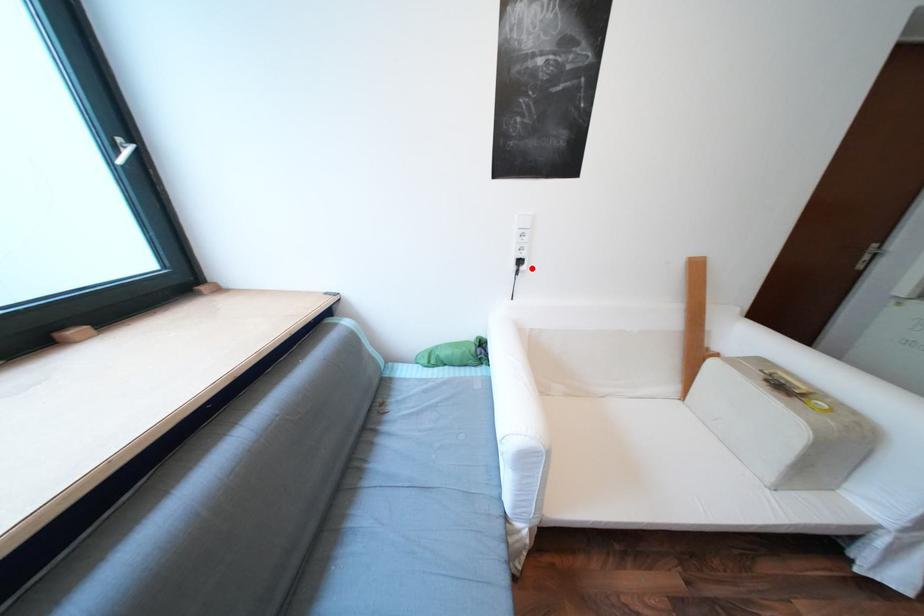
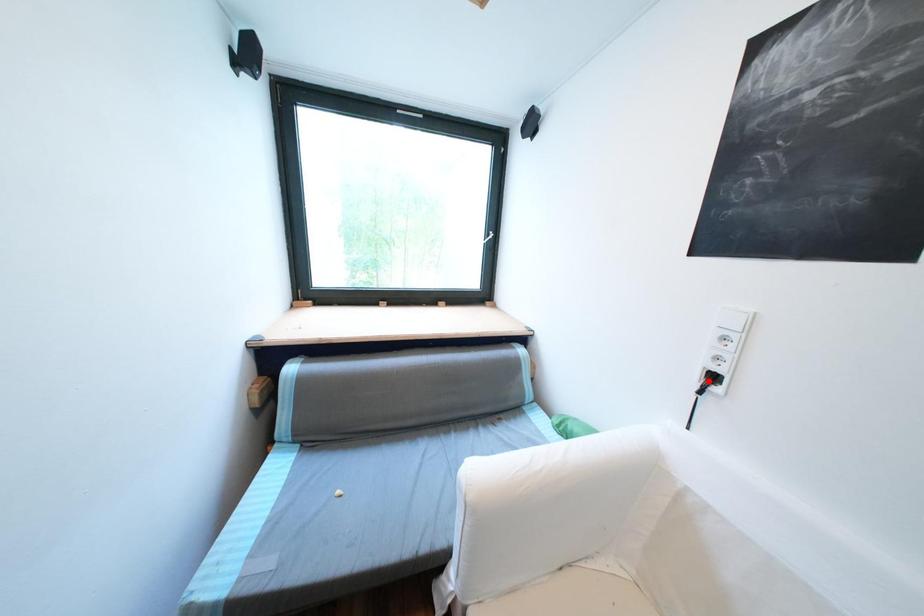
I am providing you with two images of the same scene from different viewpoints. A red point is marked on the first image and another point is marked on the second image. Does the point marked in image1 correspond to the same location as the one in image2?

No